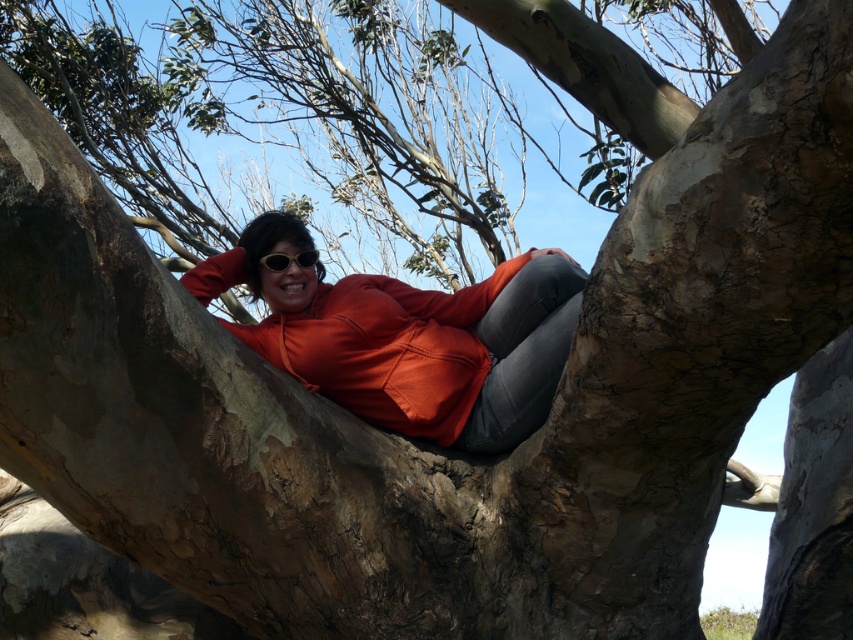
Who is shorter, matte orange sweatshirt at center or sunglasses at center?

With less height is sunglasses at center.

Is matte orange sweatshirt at center taller than sunglasses at center?

Yes, matte orange sweatshirt at center is taller than sunglasses at center.

Locate an element on the screen. Image resolution: width=853 pixels, height=640 pixels. matte orange sweatshirt at center is located at coordinates (410, 339).